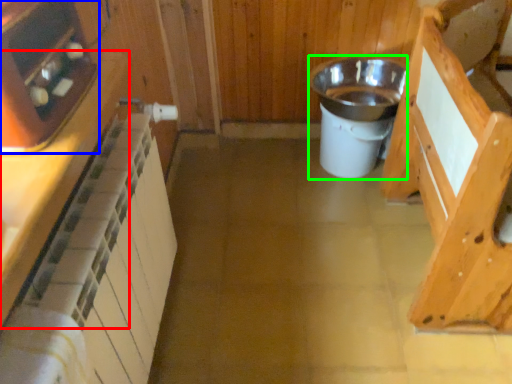
Question: Which is farther away from cabinetry (highlighted by a red box)? appliance (highlighted by a blue box) or appliance (highlighted by a green box)?

Choices:
 (A) appliance
 (B) appliance

Answer: (B)